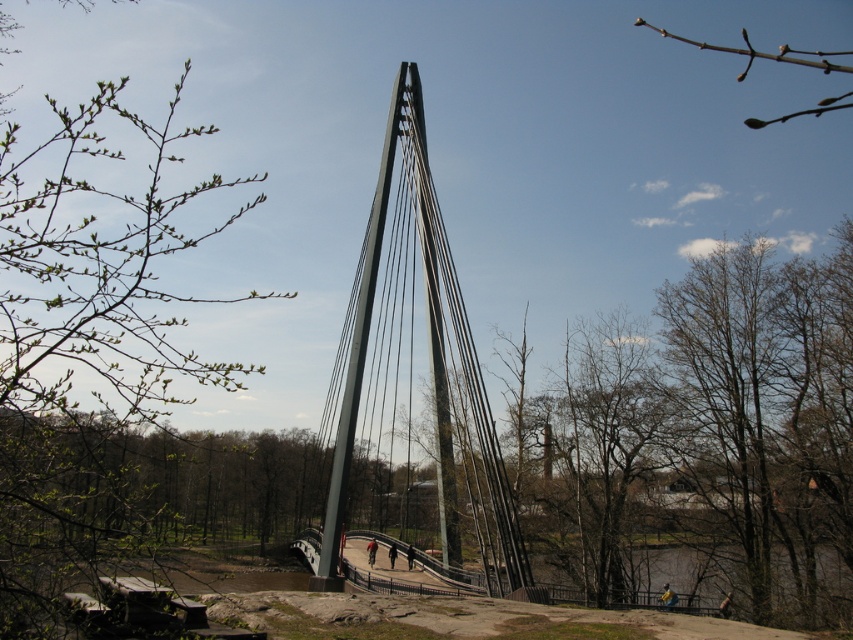
Question: Which object is farther from the camera taking this photo?

Choices:
 (A) green leafy branch at upper left
 (B) polished steel suspension bridge at center

Answer: (B)

Question: Can you confirm if green leafy branch at upper left is positioned above polished steel suspension bridge at center?

Choices:
 (A) no
 (B) yes

Answer: (B)

Question: Considering the relative positions of green leafy branch at upper left and polished steel suspension bridge at center in the image provided, where is green leafy branch at upper left located with respect to polished steel suspension bridge at center?

Choices:
 (A) below
 (B) above

Answer: (B)

Question: Can you confirm if green leafy branch at upper left is thinner than polished steel suspension bridge at center?

Choices:
 (A) no
 (B) yes

Answer: (A)

Question: Which of the following is the farthest from the observer?

Choices:
 (A) (97, 356)
 (B) (471, 340)

Answer: (B)